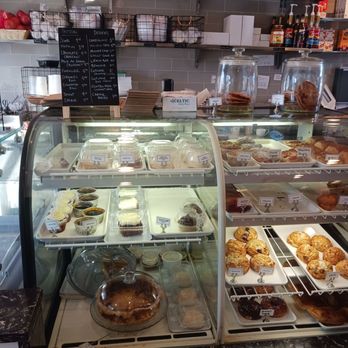
You are a GUI agent. You are given a task and a screenshot of the screen. Output one action in this format:
    pyautogui.click(x=<x>, y=<y>)
    Task: Click on the glass
    This screenshot has width=348, height=348.
    Given the screenshot: What is the action you would take?
    [x=125, y=126], [x=287, y=127], [x=246, y=72], [x=300, y=77], [x=10, y=159]